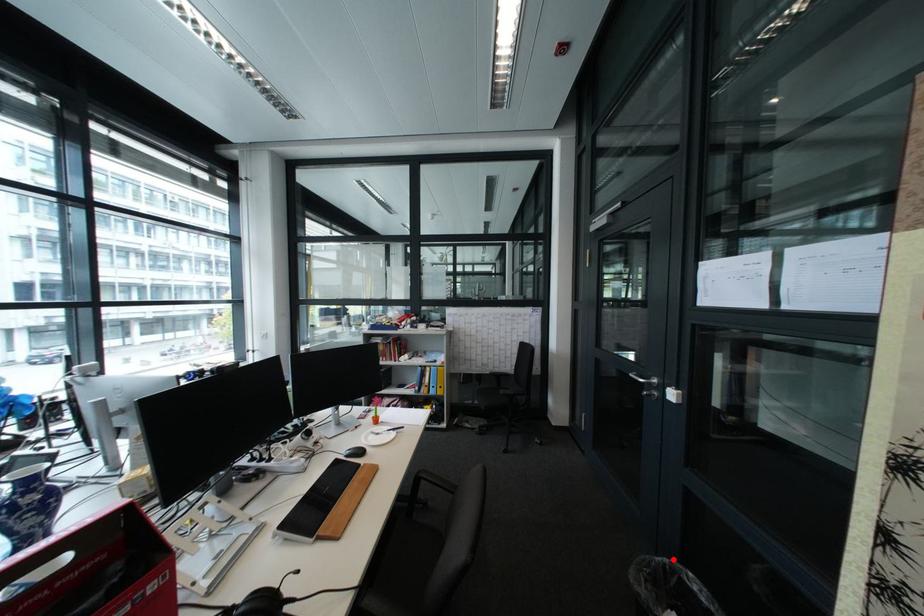
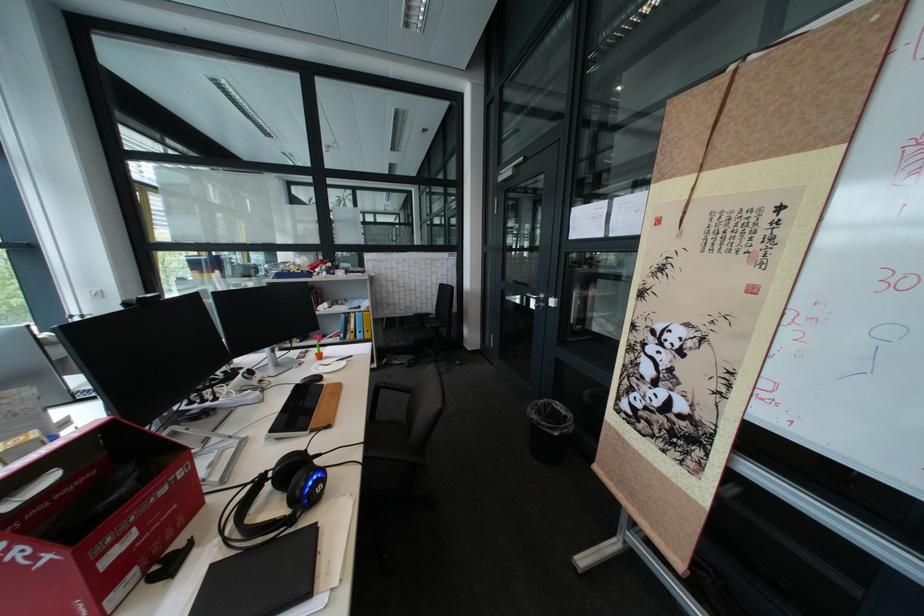
Where in the second image is the point corresponding to the highlighted location from the first image?

(555, 400)